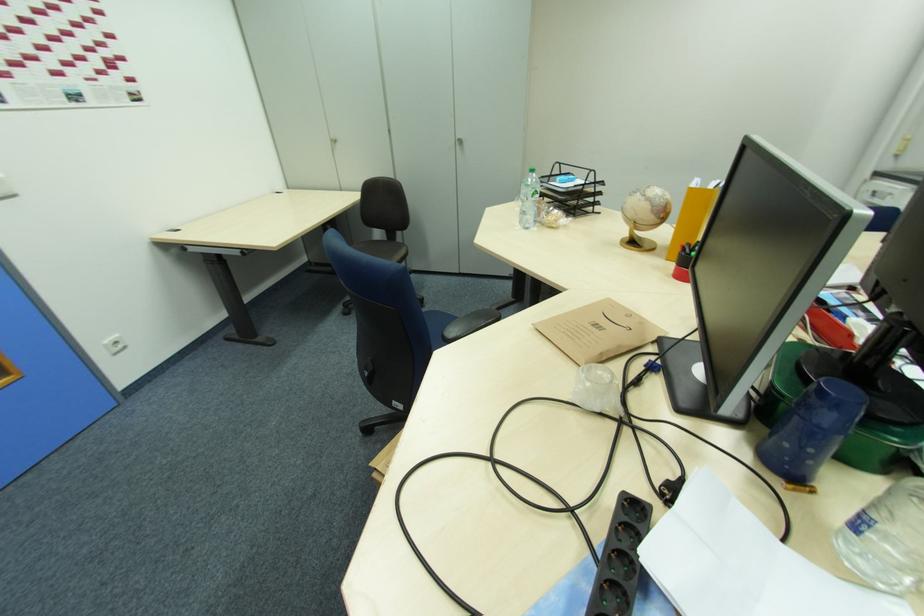
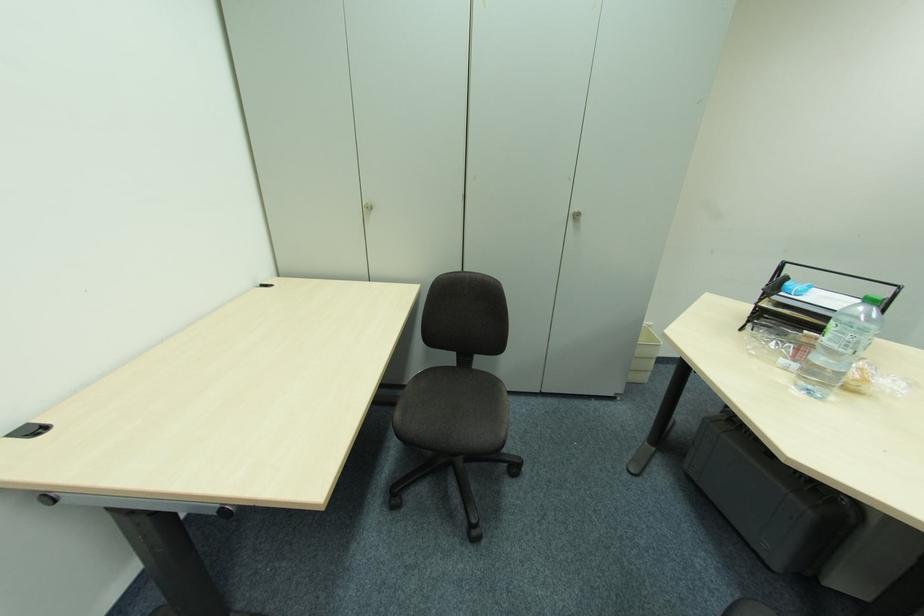
The point at (462,144) is marked in the first image. Where is the corresponding point in the second image?

(574, 219)